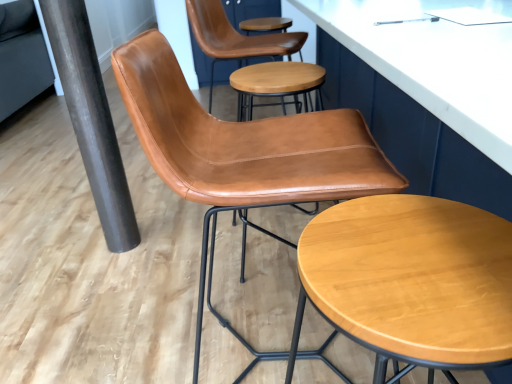
Question: Could you tell me if light brown wood stool at center is turned towards cognac leather chair at center?

Choices:
 (A) yes
 (B) no

Answer: (B)

Question: Does light brown wood stool at center come in front of cognac leather chair at center?

Choices:
 (A) no
 (B) yes

Answer: (B)

Question: Considering the relative sizes of light brown wood stool at center and cognac leather chair at center in the image provided, is light brown wood stool at center taller than cognac leather chair at center?

Choices:
 (A) no
 (B) yes

Answer: (A)

Question: From a real-world perspective, is light brown wood stool at center physically above cognac leather chair at center?

Choices:
 (A) yes
 (B) no

Answer: (B)

Question: Is light brown wood stool at center shorter than cognac leather chair at center?

Choices:
 (A) no
 (B) yes

Answer: (B)

Question: Considering the positions of light brown wood stool at center and cognac leather chair at center in the image, is light brown wood stool at center wider or thinner than cognac leather chair at center?

Choices:
 (A) thin
 (B) wide

Answer: (A)

Question: Is point (322, 292) closer or farther from the camera than point (203, 173)?

Choices:
 (A) closer
 (B) farther

Answer: (A)

Question: Relative to cognac leather chair at center, is light brown wood stool at center in front or behind?

Choices:
 (A) behind
 (B) front

Answer: (B)

Question: Is light brown wood stool at center to the left or to the right of cognac leather chair at center in the image?

Choices:
 (A) left
 (B) right

Answer: (B)

Question: Is point (116, 205) positioned closer to the camera than point (218, 193)?

Choices:
 (A) closer
 (B) farther

Answer: (B)

Question: In the image, is black metallic pole at lower left on the left side or the right side of cognac leather chair at center?

Choices:
 (A) right
 (B) left

Answer: (B)

Question: Is black metallic pole at lower left inside the boundaries of cognac leather chair at center, or outside?

Choices:
 (A) outside
 (B) inside

Answer: (A)

Question: From the image's perspective, is black metallic pole at lower left above or below cognac leather chair at center?

Choices:
 (A) above
 (B) below

Answer: (A)

Question: Looking at the image, does light brown wood stool at center seem bigger or smaller compared to black metallic pole at lower left?

Choices:
 (A) big
 (B) small

Answer: (A)

Question: Is point (359, 276) positioned closer to the camera than point (68, 94)?

Choices:
 (A) farther
 (B) closer

Answer: (B)